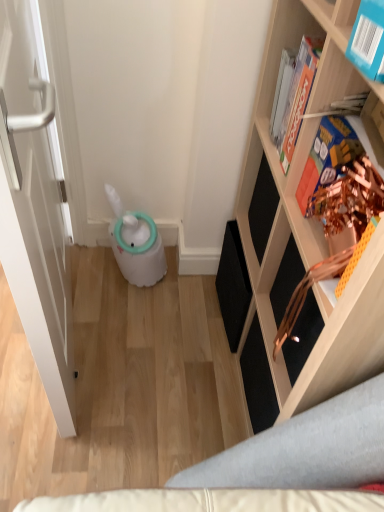
Question: From their relative heights in the image, would you say metallic gold book at upper right, the second book when ordered from back to front, is taller or shorter than blue cardboard book at upper right, acting as the third book starting from the back?

Choices:
 (A) short
 (B) tall

Answer: (B)

Question: Is point (350, 153) positioned closer to the camera than point (379, 28)?

Choices:
 (A) closer
 (B) farther

Answer: (B)

Question: Estimate the real-world distances between objects in this image. Which object is closer to the white matte door at left?

Choices:
 (A) metallic gold book at upper right, the second book when ordered from back to front
 (B) blue cardboard book at upper right, acting as the third book starting from the back
 (C) wooden shelf at right
 (D) hardcover book at upper right, the 1th book when ordered from back to front

Answer: (C)

Question: Estimate the real-world distances between objects in this image. Which object is closer to the blue cardboard book at upper right, acting as the third book starting from the back?

Choices:
 (A) white matte door at left
 (B) hardcover book at upper right, the 1th book when ordered from back to front
 (C) metallic gold book at upper right, the 2th book when ordered from front to back
 (D) wooden shelf at right

Answer: (C)